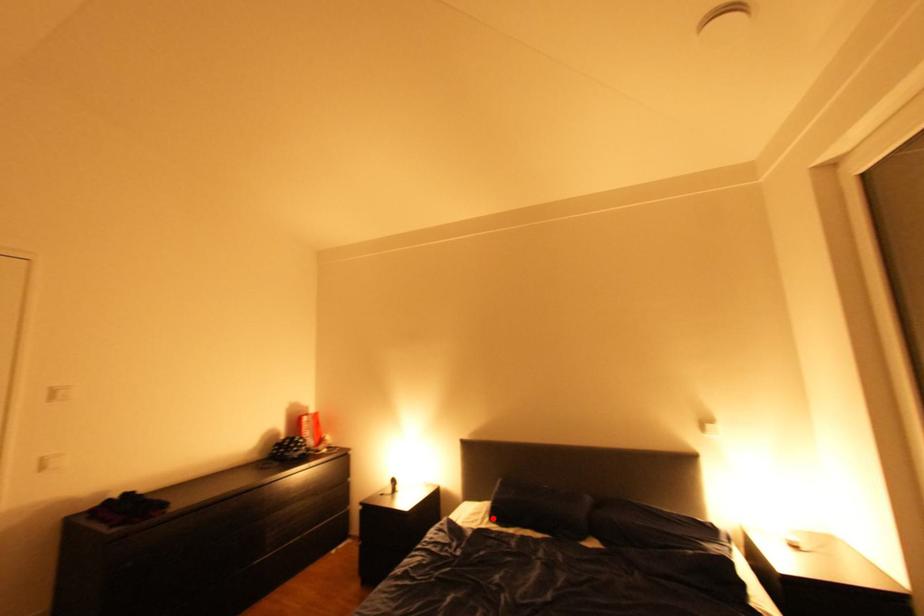
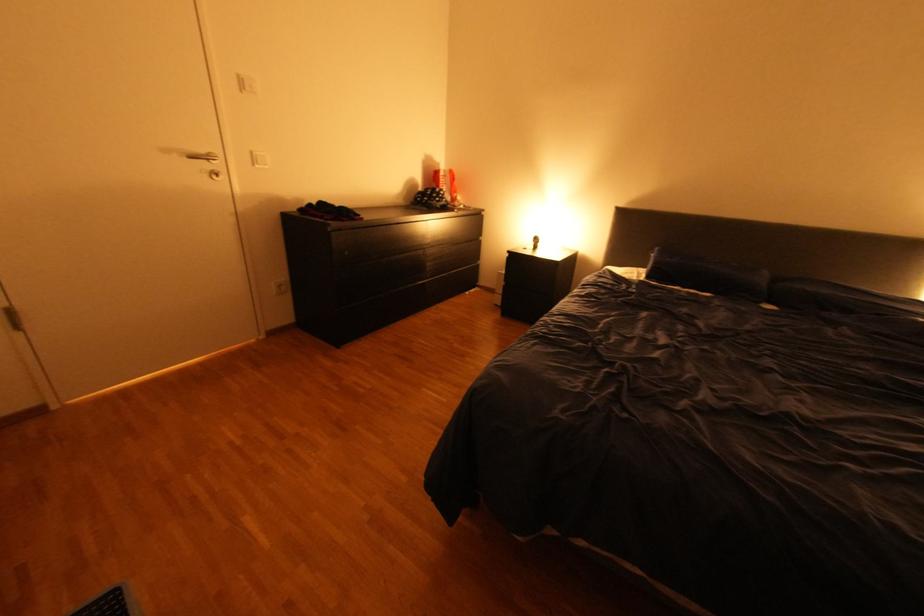
Question: I am providing you with two images of the same scene from different viewpoints. Given a red point in image1, look at the same physical point in image2. Is it:

Choices:
 (A) Closer to the viewpoint
 (B) Farther from the viewpoint

Answer: (A)